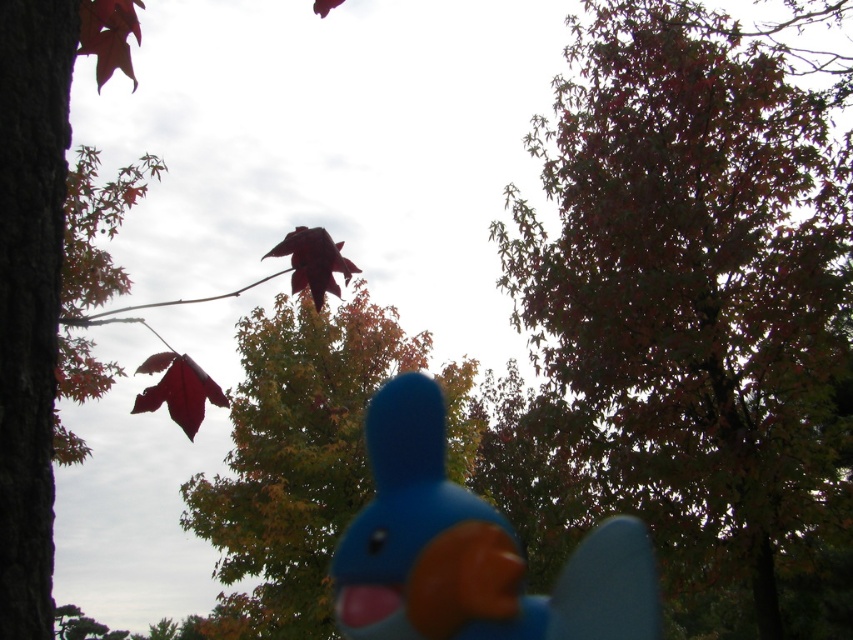
Question: Among these objects, which one is nearest to the camera?

Choices:
 (A) matte red maple leaf at center-left
 (B) shiny red maple leaf at upper left
 (C) blue rubber duck at center
 (D) shiny red maple leaf at center

Answer: (B)

Question: Which point is farther to the camera?

Choices:
 (A) blue rubber duck at center
 (B) shiny red maple leaf at upper left

Answer: (A)

Question: Can you confirm if dark green textured tree at upper center is positioned above shiny red maple leaf at upper left?

Choices:
 (A) yes
 (B) no

Answer: (A)

Question: Among these points, which one is farthest from the camera?

Choices:
 (A) (412, 586)
 (B) (339, 260)
 (C) (312, 529)

Answer: (A)

Question: Does matte red leaf at center have a smaller size compared to blue rubber duck at center?

Choices:
 (A) no
 (B) yes

Answer: (B)

Question: Is blue rubber duck at center positioned before shiny red maple leaf at center?

Choices:
 (A) yes
 (B) no

Answer: (B)